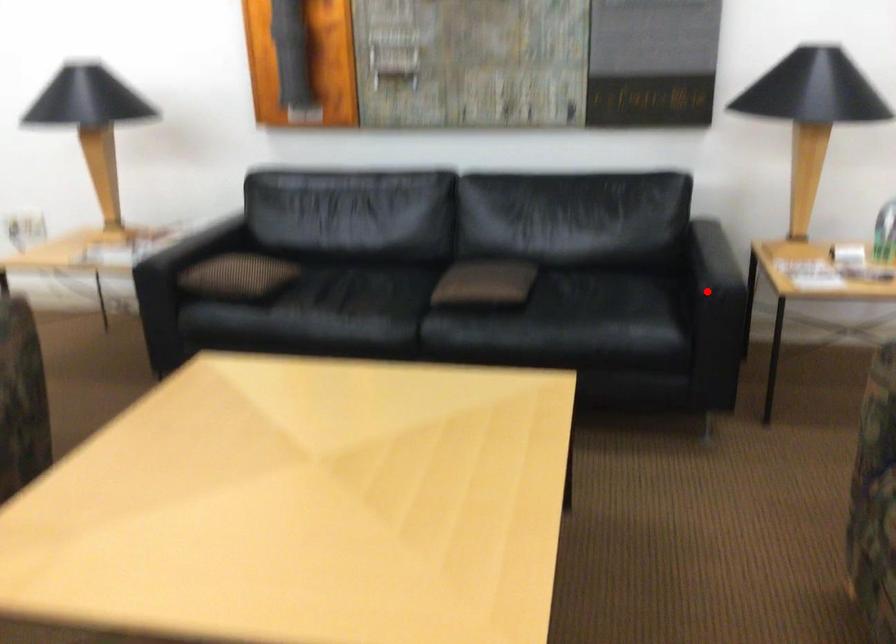
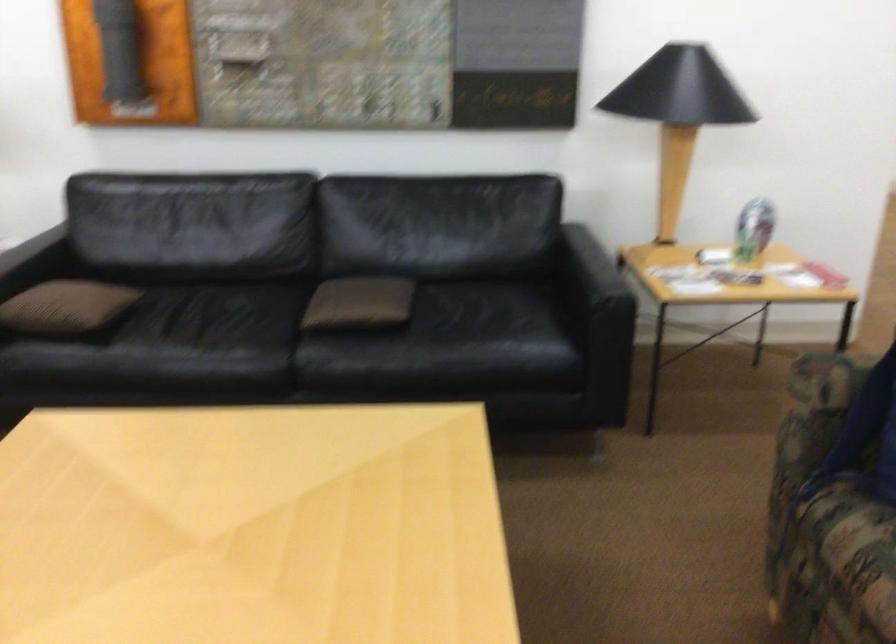
Find the pixel in the second image that matches the highlighted location in the first image.

(599, 306)